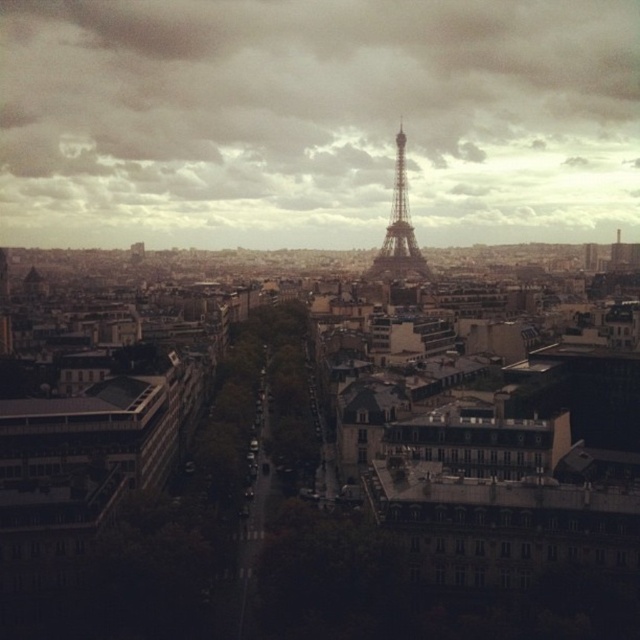
Based on the photo, is cloudy sky at center to the right of shiny metallic tower at center from the viewer's perspective?

In fact, cloudy sky at center is to the left of shiny metallic tower at center.

Image resolution: width=640 pixels, height=640 pixels. Describe the element at coordinates (316, 122) in the screenshot. I see `cloudy sky at center` at that location.

You are a GUI agent. You are given a task and a screenshot of the screen. Output one action in this format:
    pyautogui.click(x=<x>, y=<y>)
    Task: Click on the cloudy sky at center
    The height and width of the screenshot is (640, 640).
    Given the screenshot: What is the action you would take?
    pyautogui.click(x=316, y=122)